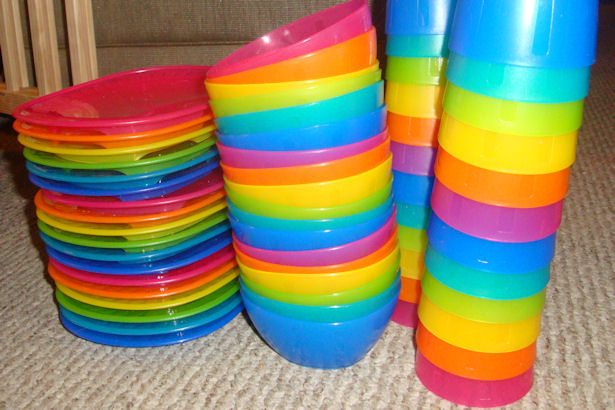
Locate an element on the screen. This screenshot has height=410, width=615. cups is located at coordinates (427, 46).